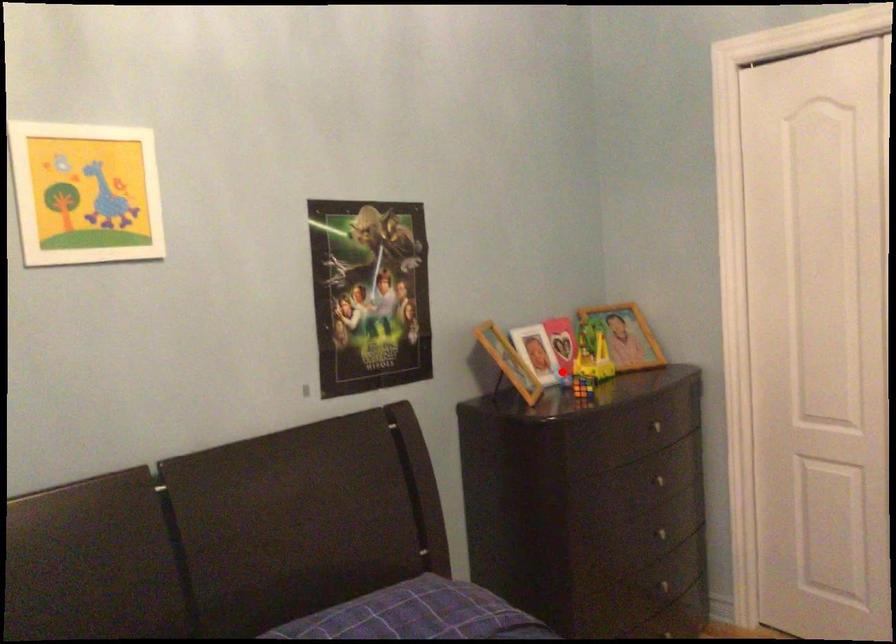
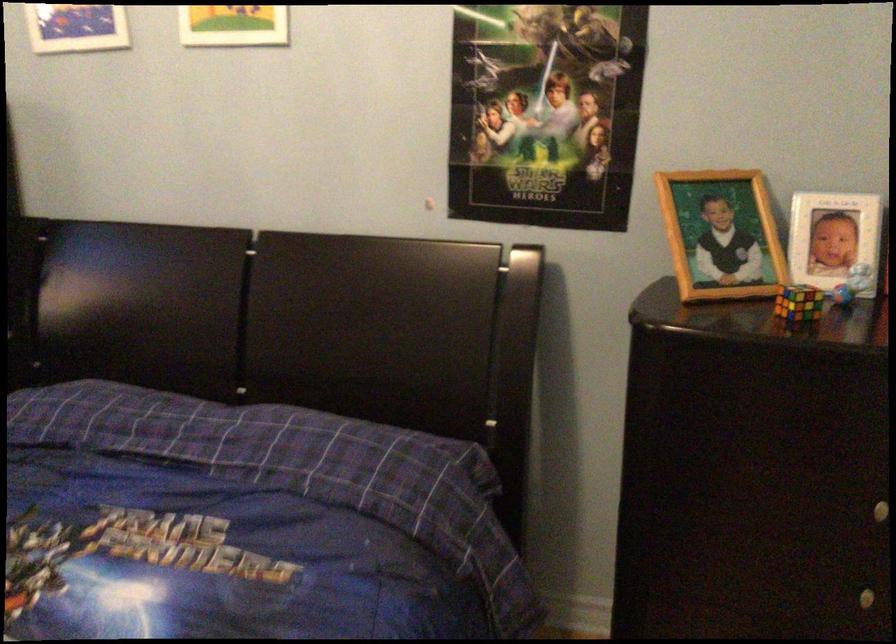
Question: I am providing you with two images of the same scene from different viewpoints. Given a red point in image1, look at the same physical point in image2. Is it:

Choices:
 (A) Closer to the viewpoint
 (B) Farther from the viewpoint

Answer: (A)